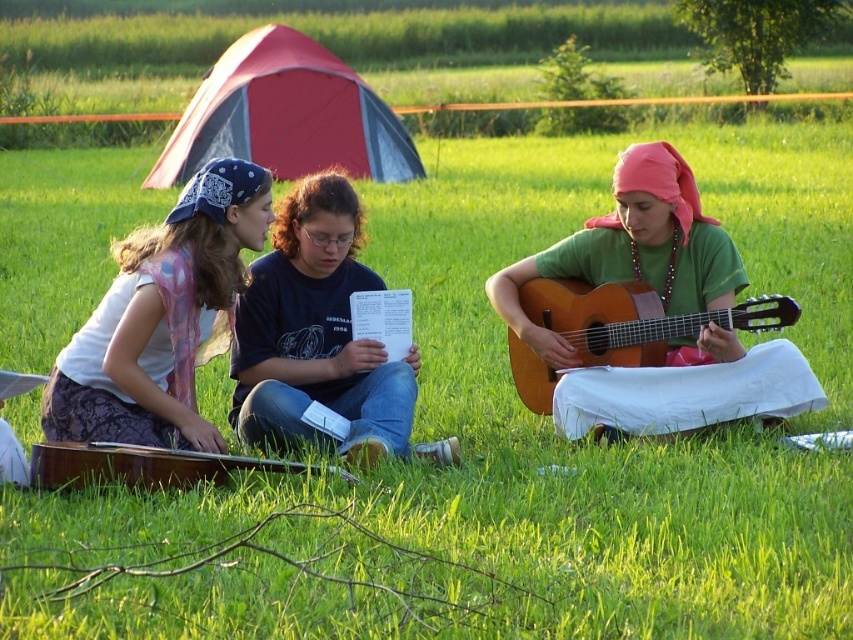
Question: Is matte green guitar at center further to the viewer compared to brown wooden guitar at lower left?

Choices:
 (A) no
 (B) yes

Answer: (B)

Question: Which of the following is the closest to the observer?

Choices:
 (A) (782, 321)
 (B) (341, 100)
 (C) (341, 234)

Answer: (A)

Question: Estimate the real-world distances between objects in this image. Which object is closer to the brown wooden guitar at lower left?

Choices:
 (A) matte pink scarf at left
 (B) matte green guitar at center

Answer: (A)

Question: Estimate the real-world distances between objects in this image. Which object is farther from the matte black shirt at center?

Choices:
 (A) brown wooden guitar at lower left
 (B) acoustic wood guitar at right

Answer: (B)

Question: Is matte green guitar at center in front of red fabric tent at upper center?

Choices:
 (A) yes
 (B) no

Answer: (A)

Question: Is matte black shirt at center to the left of brown wooden guitar at lower left from the viewer's perspective?

Choices:
 (A) yes
 (B) no

Answer: (B)